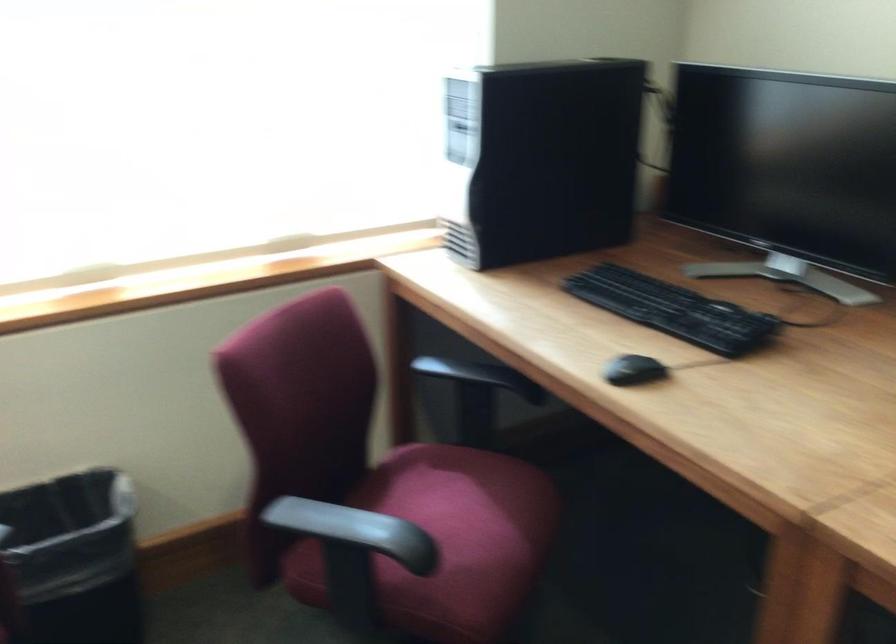
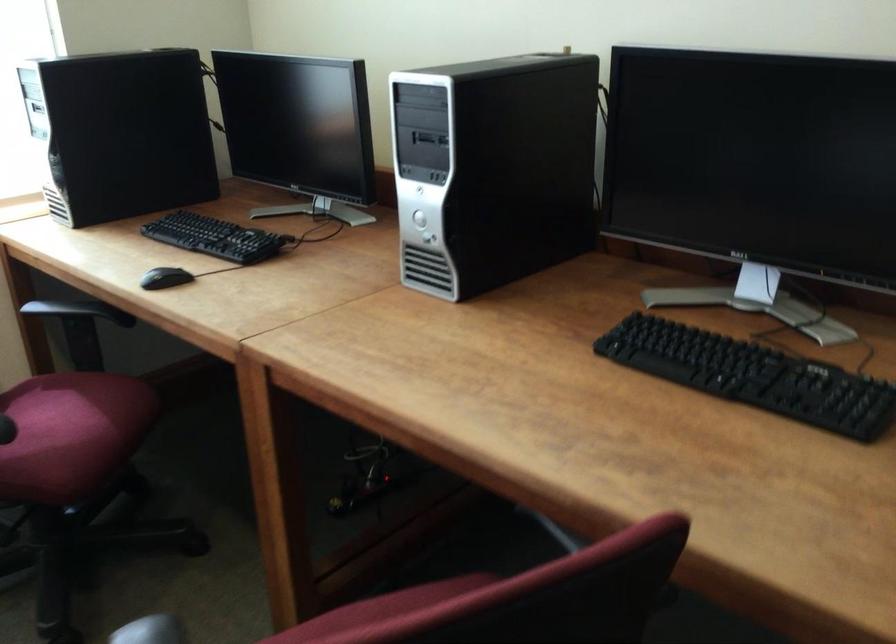
Find the pixel in the second image that matches [478,536] in the first image.

(73, 428)